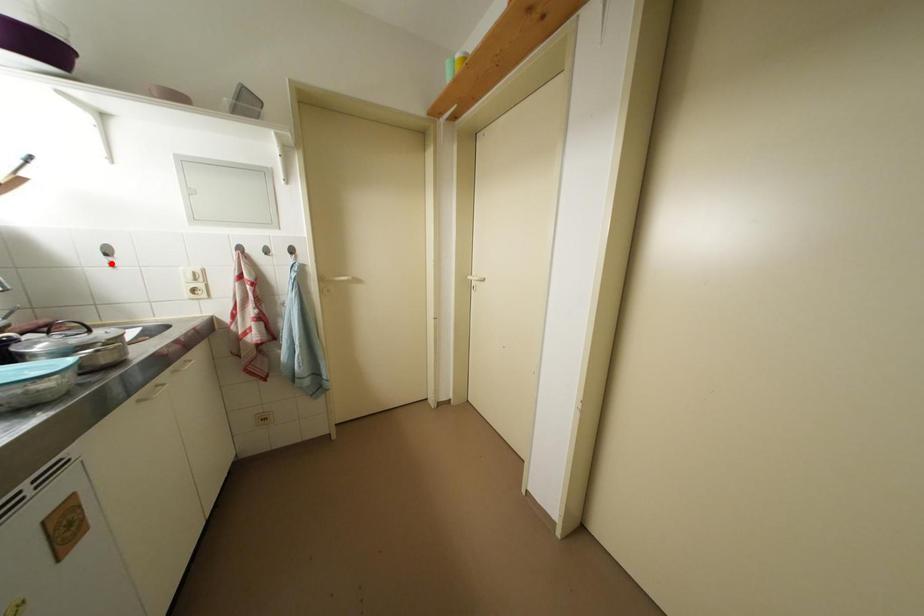
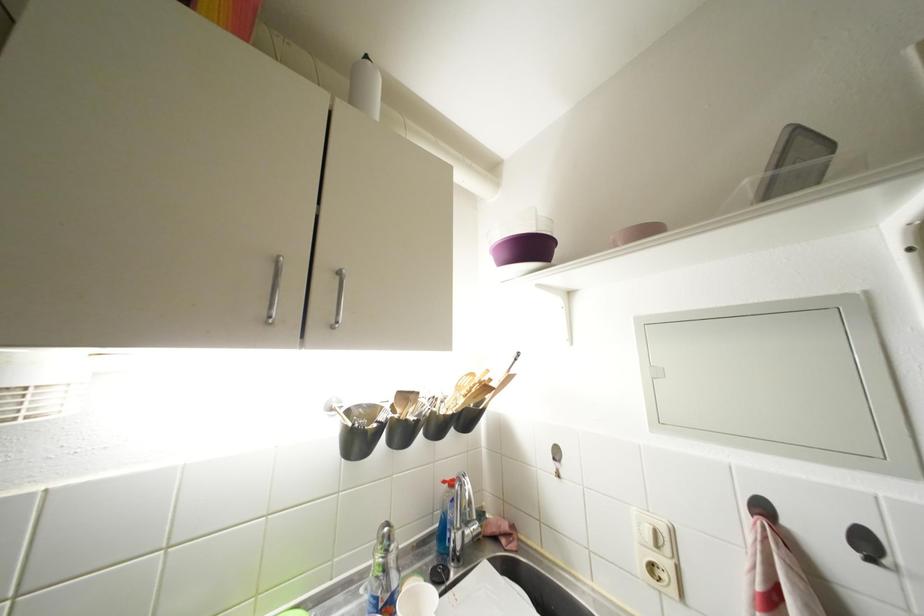
The point at the highlighted location is marked in the first image. Where is the corresponding point in the second image?

(560, 469)